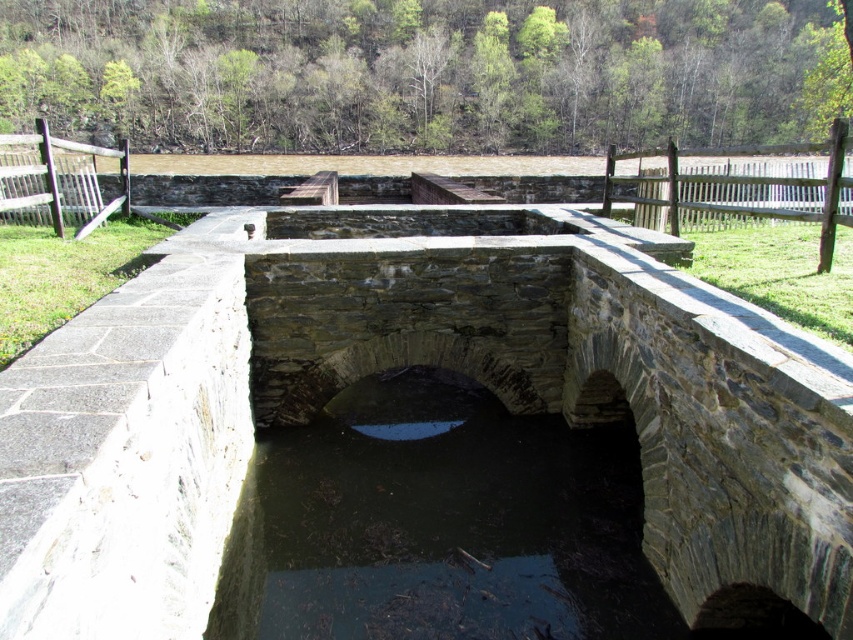
You are a construction worker inspecting the stone structure. You need to determine which object occupies more space in the image between the gray stone bridge at center and the dark stone water at center. Based on the scene, which one is larger?

The gray stone bridge at center is bigger than the dark stone water at center, so the gray stone bridge at center occupies more space in the image.

You are standing on the gray stone bridge at center and looking towards the dark stone water at center. Which object is closer to you?

The gray stone bridge at center is closer to you since it is in front of the dark stone water at center.

You are standing on the gray stone bridge at center and want to cross to the other side. Is the dark stone water at center directly in front of you or to your right?

The gray stone bridge at center is to the left of dark stone water at center, so the dark stone water at center is to your right when facing the bridge.